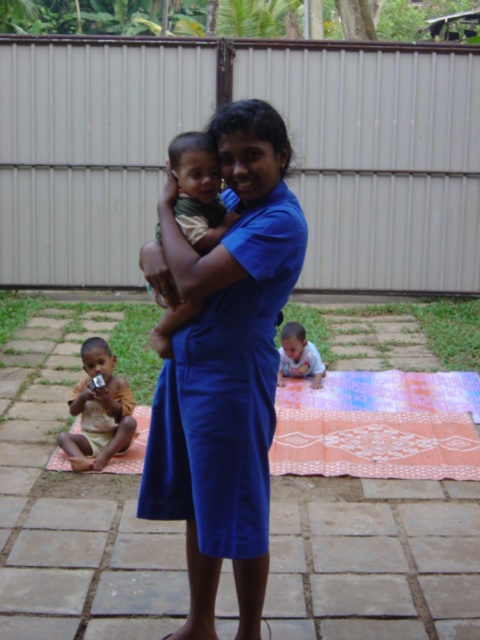
You are standing at the point labeled point [193,179] and want to walk to the point labeled point [283,362]. Which direction should you move in to reach your destination?

To reach point [283,362] from point [193,179], you should move towards the right and upwards since point [193,179] is in front of point [283,362], indicating it is closer to the viewer. Moving away from the viewer would mean going towards the background, which aligns with the direction of point [283,362].

You are a photographer trying to capture a closeup of the baby in the scene. The baby is wearing a matte green shirt at center and has soft beige skin at center. Which part of the baby should you focus on to ensure the entire body is in frame?

The matte green shirt at center is smaller than soft beige skin at center, so focusing on the soft beige skin at center will ensure the entire body is captured in the frame.

Where is the matte green shirt at center located in the image?

The matte green shirt at center is located at point coordinates of approximately 0.298 on the x axis and 0.412 on the y axis.